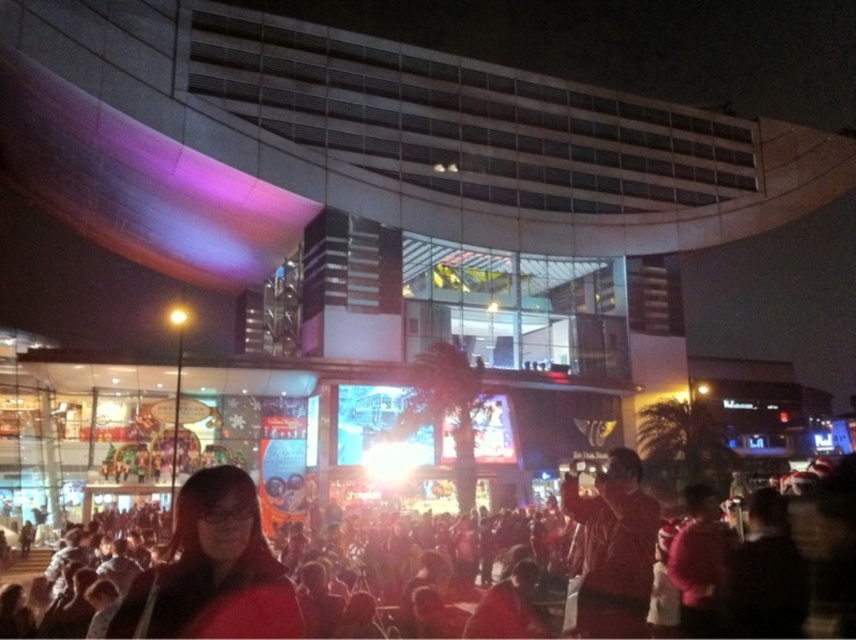
You are a photographer standing in front of the modern building. You want to take a photo that includes both the matte black crowd at center and the red leather jacket at lower right. Which object should you frame first to ensure both fit in the shot?

You should frame the matte black crowd at center first because its width is larger than the red leather jacket at lower right, so starting with the wider object ensures there is enough space to include the narrower one as well.

From the picture: You are a photographer standing at the edge of the crowd. You notice two people in the scene described. The first has matte black hair at lower center, and the second is wearing a red leather jacket at lower right. Which of these two people is positioned higher from the ground?

The matte black hair at lower center is positioned higher than the red leather jacket at lower right because it is above it.